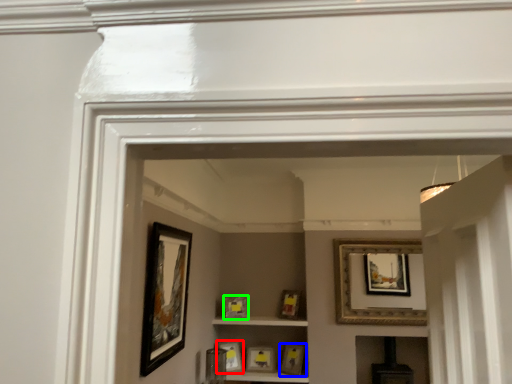
Question: Estimate the real-world distances between objects in this image. Which object is closer to picture frame (highlighted by a red box), picture frame (highlighted by a blue box) or picture frame (highlighted by a green box)?

Choices:
 (A) picture frame
 (B) picture frame

Answer: (B)